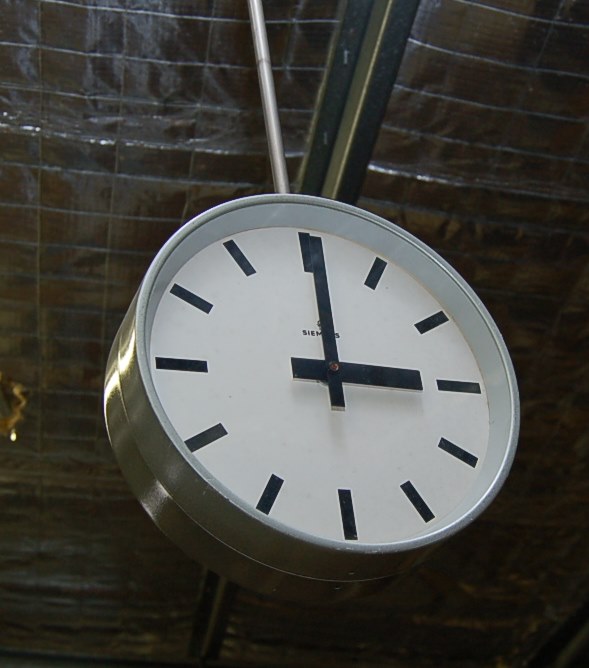
At what (x,y) coordinates should I click in order to perform the action: click on clock. Please return your answer as a coordinate pair (x, y). This screenshot has height=668, width=589. Looking at the image, I should click on (316, 538).